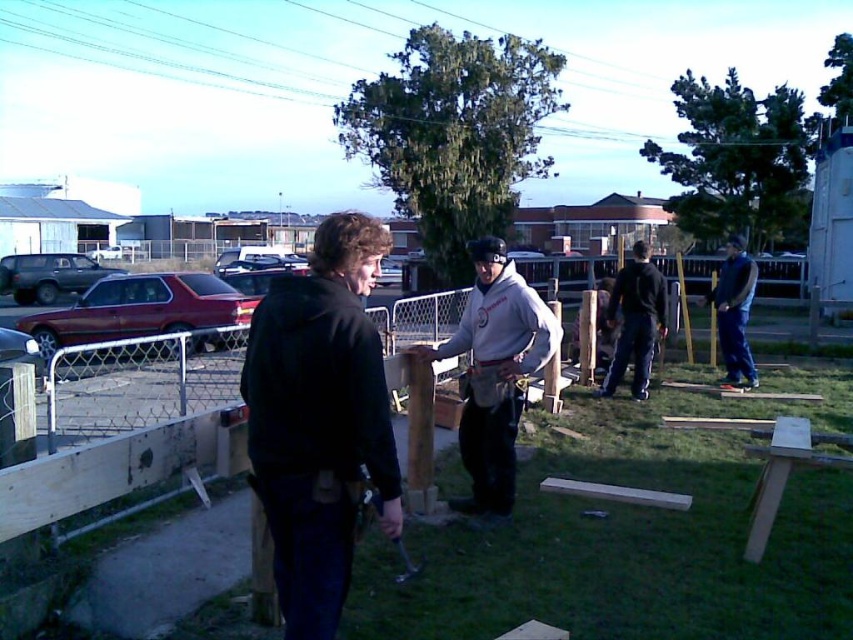
Can you confirm if smooth wood picnic table at lower right is bigger than blue jeans at right?

No, smooth wood picnic table at lower right is not bigger than blue jeans at right.

Between smooth wood picnic table at lower right and blue jeans at right, which one has less height?

With less height is smooth wood picnic table at lower right.

Does point (770, 525) come behind point (737, 237)?

No, it is in front of (737, 237).

Where is `smooth wood picnic table at lower right`? The image size is (853, 640). smooth wood picnic table at lower right is located at coordinates (784, 470).

Based on the photo, can you confirm if black matte jacket at center is bigger than dark gray hoodie at center?

Actually, black matte jacket at center might be smaller than dark gray hoodie at center.

Between black matte jacket at center and dark gray hoodie at center, which one has less height?

dark gray hoodie at center

You are a GUI agent. You are given a task and a screenshot of the screen. Output one action in this format:
    pyautogui.click(x=<x>, y=<y>)
    Task: Click on the black matte jacket at center
    The image size is (853, 640).
    Given the screenshot: What is the action you would take?
    coord(318,419)

Identify the location of black matte jacket at center. (318, 419).

Which is in front, point (374, 474) or point (746, 296)?

Positioned in front is point (374, 474).

Can you confirm if black matte jacket at center is positioned above blue jeans at right?

Actually, black matte jacket at center is below blue jeans at right.

Who is more distant from viewer, [337,490] or [729,252]?

Point [729,252]

Locate an element on the screen. This screenshot has height=640, width=853. black matte jacket at center is located at coordinates pyautogui.click(x=318, y=419).